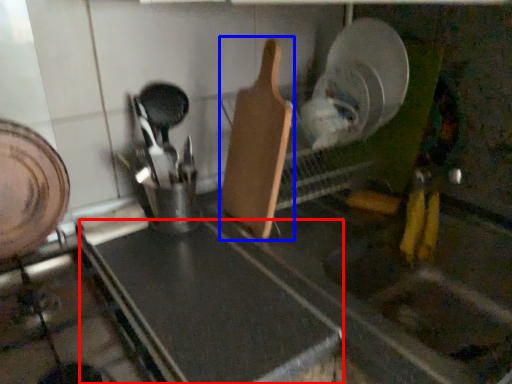
Question: Which of the following is the farthest to the observer, counter top (highlighted by a red box) or spatula (highlighted by a blue box)?

Choices:
 (A) counter top
 (B) spatula

Answer: (B)